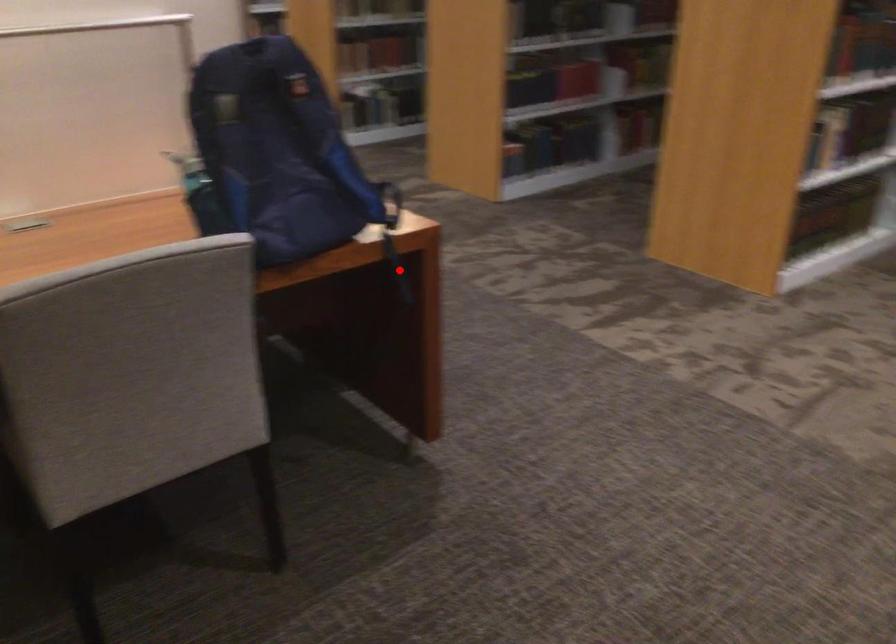
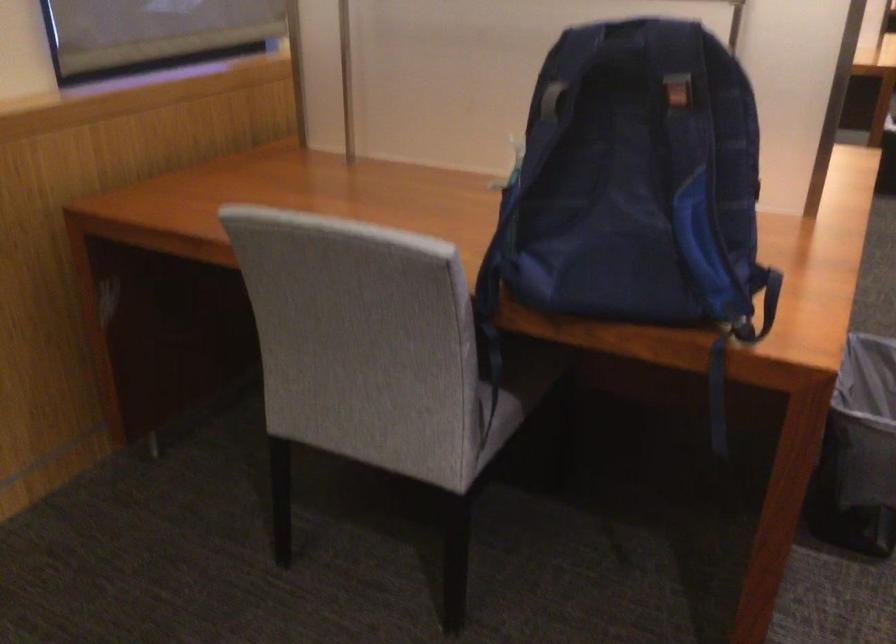
Question: I am providing you with two images of the same scene from different viewpoints. Image1 has a red point marked. In image2, the corresponding 3D location appears at what relative position? Reply with the corresponding letter.

Choices:
 (A) Closer
 (B) Farther

Answer: (A)